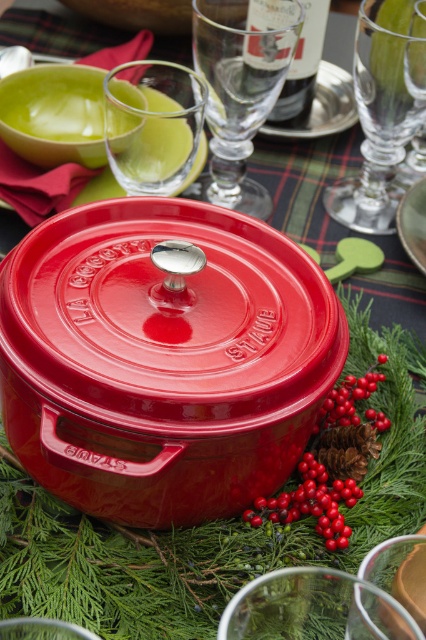
Is transparent glass wine glass at upper right positioned in front of transparent glass at upper right?

Yes, transparent glass wine glass at upper right is in front of transparent glass at upper right.

Which is above, transparent glass wine glass at upper right or transparent glass at upper right?

Positioned higher is transparent glass at upper right.

Between point (397, 116) and point (409, 45), which one is positioned in front?

Positioned in front is point (409, 45).

At what (x,y) coordinates should I click in order to perform the action: click on transparent glass wine glass at upper right. Please return your answer as a coordinate pair (x, y). This screenshot has width=426, height=640. Looking at the image, I should click on (382, 109).

Between transparent glass at upper center and glossy red berry at lower right, which one is positioned lower?

glossy red berry at lower right

Is point (109, 124) more distant than point (334, 406)?

Yes, it is.

What do you see at coordinates (152, 124) in the screenshot? The image size is (426, 640). I see `transparent glass at upper center` at bounding box center [152, 124].

I want to click on transparent glass at upper center, so click(x=152, y=124).

Is transparent glass wine glass at upper right to the left of transparent glass at upper center from the viewer's perspective?

In fact, transparent glass wine glass at upper right is to the right of transparent glass at upper center.

Between transparent glass wine glass at upper right and transparent glass at upper center, which one has less height?

With less height is transparent glass at upper center.

Image resolution: width=426 pixels, height=640 pixels. What do you see at coordinates (382, 109) in the screenshot? I see `transparent glass wine glass at upper right` at bounding box center [382, 109].

The height and width of the screenshot is (640, 426). What are the coordinates of `transparent glass wine glass at upper right` in the screenshot? It's located at (382, 109).